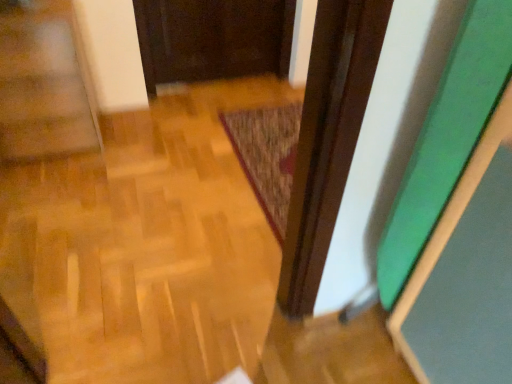
Question: Is wooden parquet floor at lower left shorter than textured brown mat at center?

Choices:
 (A) no
 (B) yes

Answer: (A)

Question: From the image's perspective, is wooden parquet floor at lower left above textured brown mat at center?

Choices:
 (A) yes
 (B) no

Answer: (A)

Question: From the image's perspective, is wooden parquet floor at lower left below textured brown mat at center?

Choices:
 (A) yes
 (B) no

Answer: (B)

Question: Can you confirm if wooden parquet floor at lower left is wider than textured brown mat at center?

Choices:
 (A) no
 (B) yes

Answer: (A)

Question: Is wooden parquet floor at lower left positioned far away from textured brown mat at center?

Choices:
 (A) yes
 (B) no

Answer: (B)

Question: Considering the relative sizes of wooden parquet floor at lower left and textured brown mat at center in the image provided, is wooden parquet floor at lower left thinner than textured brown mat at center?

Choices:
 (A) yes
 (B) no

Answer: (A)

Question: Is the position of textured brown mat at center more distant than that of wooden parquet floor at lower left?

Choices:
 (A) no
 (B) yes

Answer: (B)

Question: From the image's perspective, is textured brown mat at center under wooden parquet floor at lower left?

Choices:
 (A) no
 (B) yes

Answer: (B)

Question: From a real-world perspective, is textured brown mat at center beneath wooden parquet floor at lower left?

Choices:
 (A) no
 (B) yes

Answer: (B)

Question: Can you confirm if textured brown mat at center is wider than wooden parquet floor at lower left?

Choices:
 (A) yes
 (B) no

Answer: (A)

Question: Is textured brown mat at center oriented towards wooden parquet floor at lower left?

Choices:
 (A) yes
 (B) no

Answer: (B)

Question: Are textured brown mat at center and wooden parquet floor at lower left located far from each other?

Choices:
 (A) no
 (B) yes

Answer: (A)

Question: In the image, is textured brown mat at center positioned in front of or behind wooden parquet floor at lower left?

Choices:
 (A) behind
 (B) front

Answer: (A)